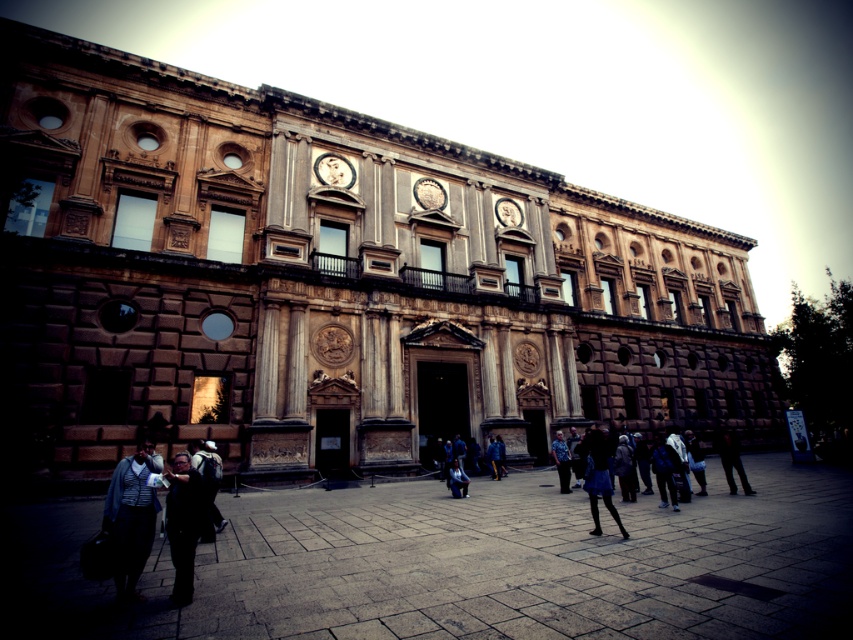
You are a visitor standing in front of the grand historical building. You notice the dark gray suit at lower left and the gold metallic clock at upper center. Which object is larger in size?

The dark gray suit at lower left is bigger than the gold metallic clock at upper center.

You are standing in front of the grand historical building and notice a point marked at coordinates (598, 476). Based on the scene description, what object is this point located on?

The point at coordinates (598, 476) is located on the blue denim skirt at lower center.

Based on the photo, you are a fashion designer observing the grand historical building and need to determine if the blue denim skirt at lower center can be displayed alongside the matte black backpack at lower left in a narrow exhibition space. Can you fit both items side by side if the space is 1.2 meters wide?

The blue denim skirt at lower center might be wider than matte black backpack at lower left, so it is uncertain if both will fit within the 1.2 meters width. Measure their exact widths to confirm.